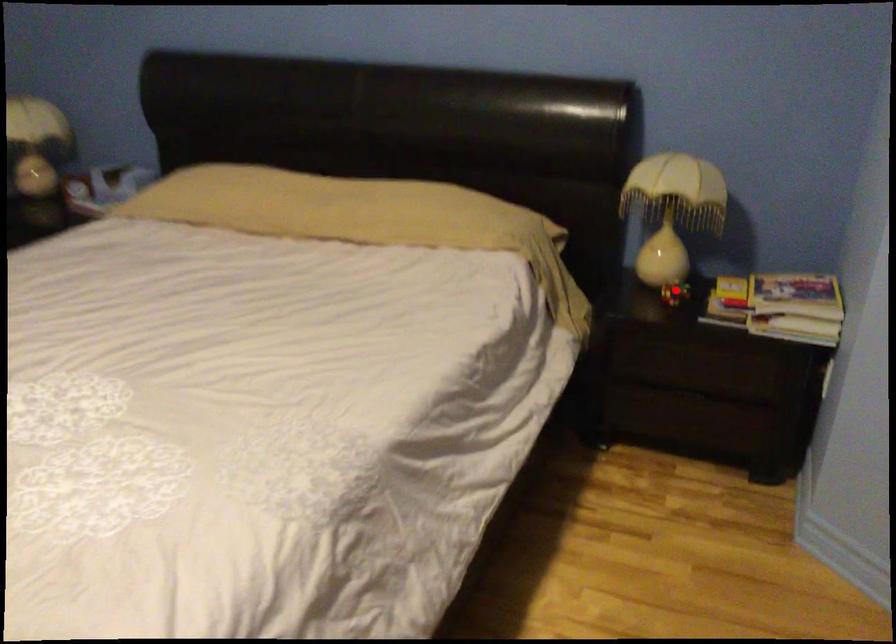
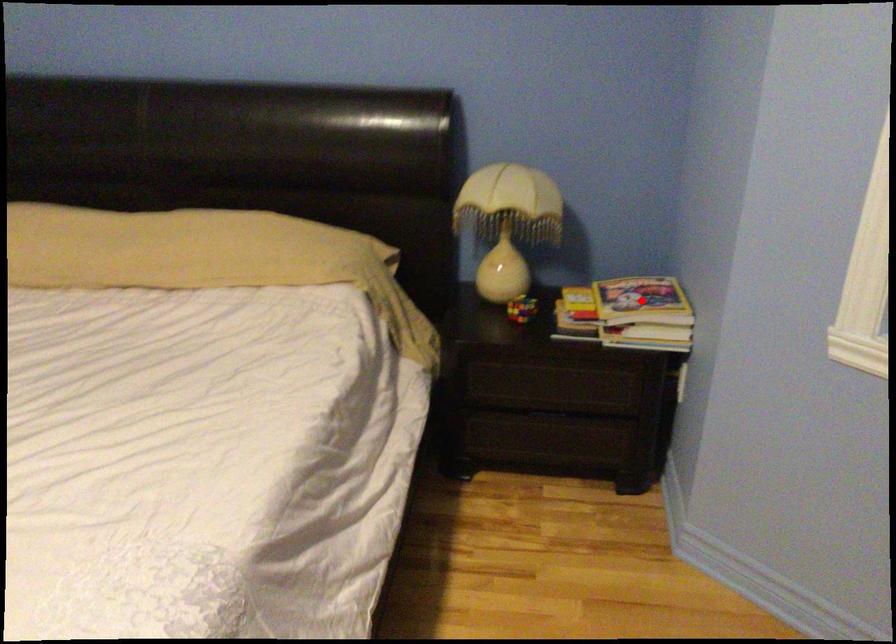
I am providing you with two images of the same scene from different viewpoints. A red point is marked on the first image and another point is marked on the second image. Does the point marked in image1 correspond to the same location as the one in image2?

No